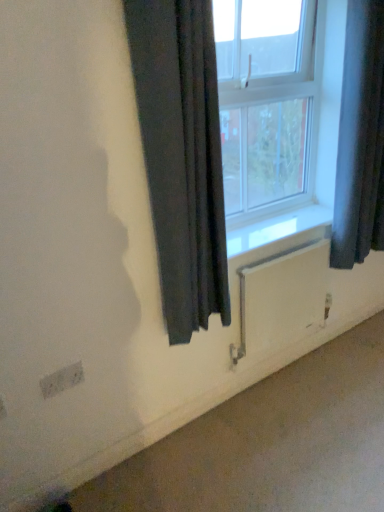
Question: From the image's perspective, is black fabric curtain at center, which appears as the 1th curtain when viewed from the left, above or below dark fabric curtain at right, the second curtain from the left?

Choices:
 (A) above
 (B) below

Answer: (B)

Question: Looking at the image, does black fabric curtain at center, the second curtain in the right-to-left sequence, seem bigger or smaller compared to dark fabric curtain at right, the second curtain from the left?

Choices:
 (A) small
 (B) big

Answer: (A)

Question: Based on their relative distances, which object is farther from the smooth concrete at lower right?

Choices:
 (A) black fabric curtain at center, which appears as the 1th curtain when viewed from the left
 (B) white painted wood at lower center
 (C) white plastic window at center
 (D) dark fabric curtain at right, acting as the 1th curtain starting from the right
 (E) white matte radiator at lower center

Answer: (C)

Question: Estimate the real-world distances between objects in this image. Which object is farther from the white plastic window at center?

Choices:
 (A) smooth concrete at lower right
 (B) black fabric curtain at center, the second curtain in the right-to-left sequence
 (C) white painted wood at lower center
 (D) white matte radiator at lower center
 (E) dark fabric curtain at right, the second curtain from the left

Answer: (A)